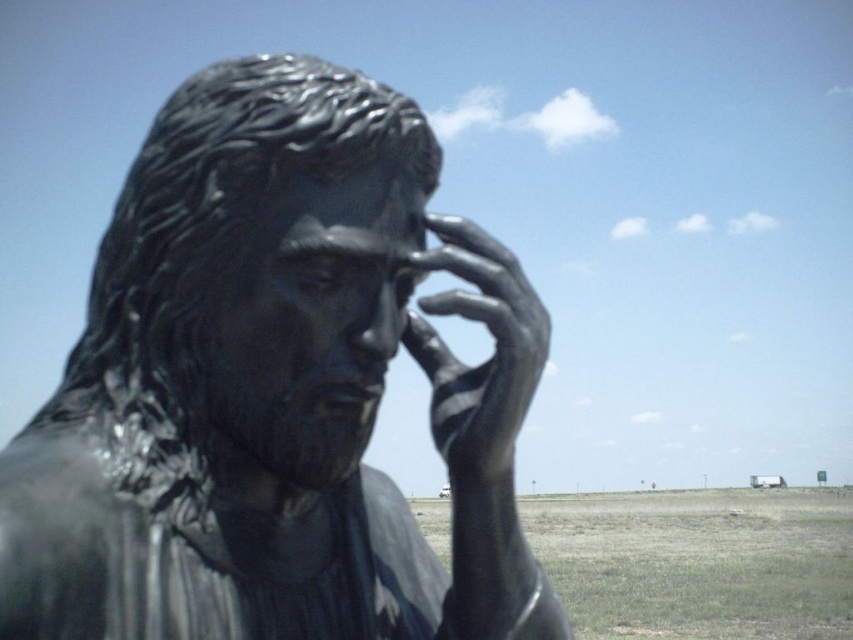
Question: Does shiny bronze statue at center come in front of shiny metallic hand at center?

Choices:
 (A) yes
 (B) no

Answer: (A)

Question: Is shiny bronze statue at center positioned in front of shiny metallic hand at center?

Choices:
 (A) yes
 (B) no

Answer: (A)

Question: Does shiny bronze statue at center appear on the right side of shiny metallic hand at center?

Choices:
 (A) yes
 (B) no

Answer: (B)

Question: Which point is closer to the camera?

Choices:
 (A) shiny bronze statue at center
 (B) shiny metallic hand at center

Answer: (A)